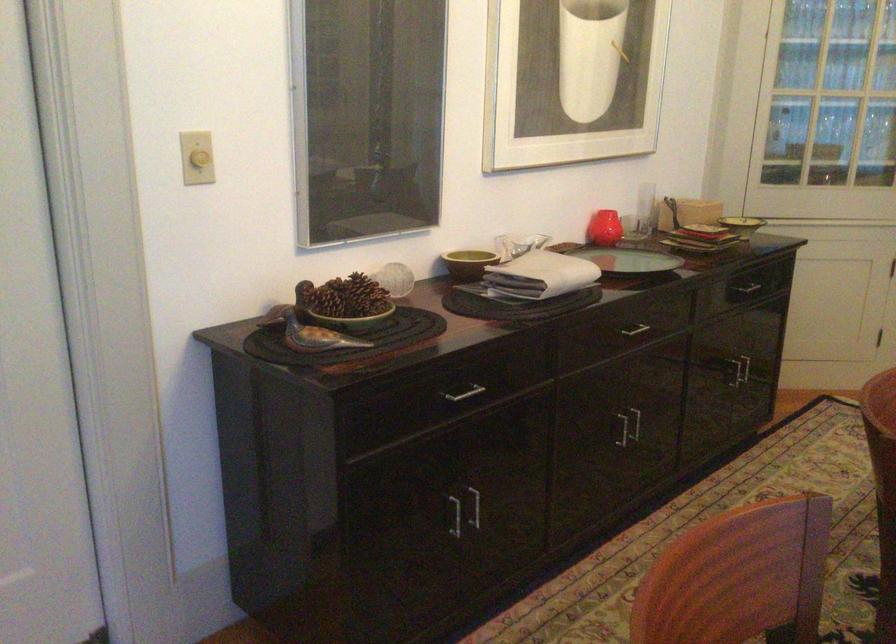
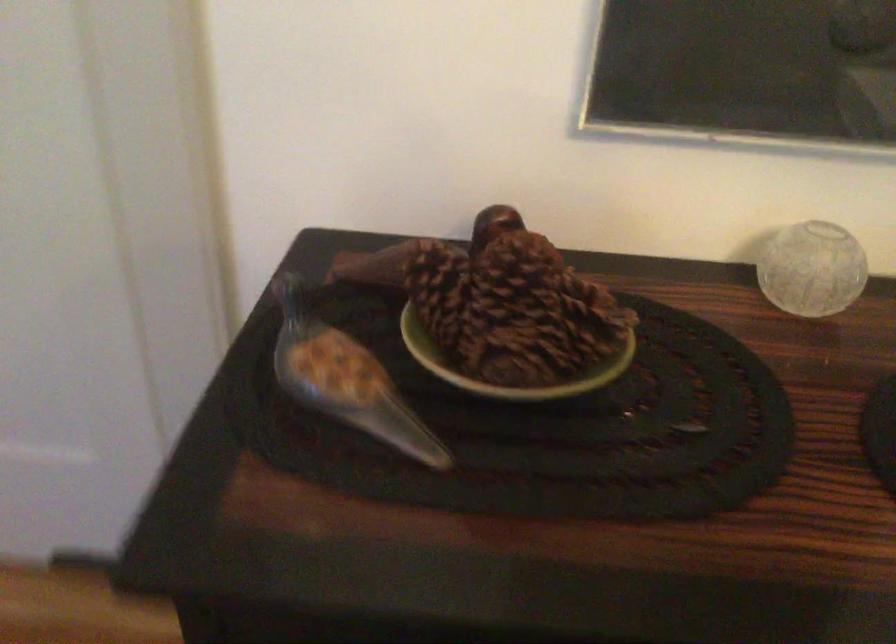
Find the pixel in the second image that matches (314,330) in the first image.

(347, 386)